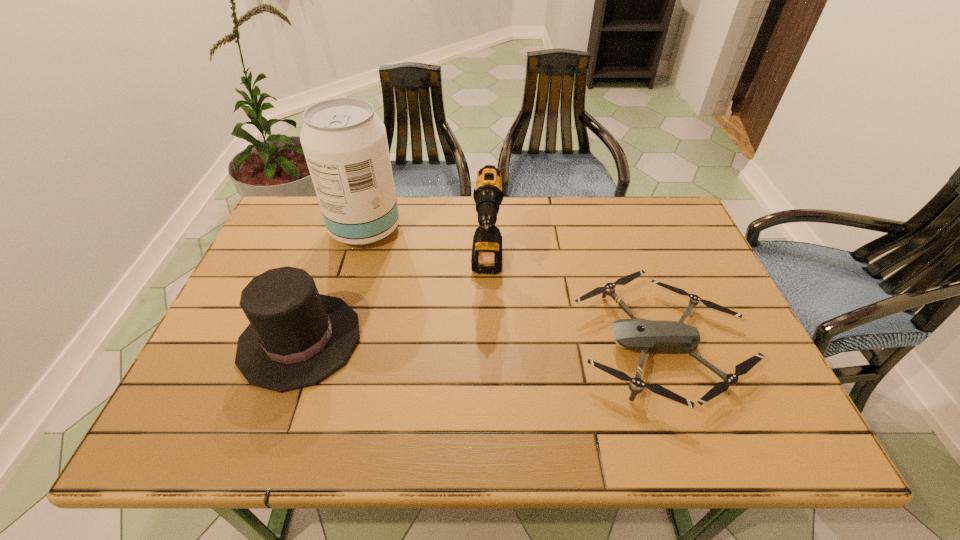
This screenshot has width=960, height=540. What are the coordinates of `alcohol` in the screenshot? It's located at (345, 144).

Where is `the third shortest object`? The width and height of the screenshot is (960, 540). the third shortest object is located at coordinates (486, 257).

The width and height of the screenshot is (960, 540). Identify the location of drill. (486, 257).

Where is `dress hat`? dress hat is located at coordinates (297, 337).

I want to click on the rightmost object, so click(653, 336).

Find the location of a particular element. The width and height of the screenshot is (960, 540). drone is located at coordinates (653, 336).

The height and width of the screenshot is (540, 960). Identify the location of free location located 0.120m on the front of the tallest object. (349, 282).

The width and height of the screenshot is (960, 540). I want to click on free space located 0.060m at the tip of the drill, so click(x=488, y=316).

This screenshot has width=960, height=540. In order to click on vacant space located on the front of the dress hat with the decoration in this screenshot , I will do `click(482, 340)`.

Locate an element on the screen. This screenshot has width=960, height=540. vacant region located with a camera mounted on the front of the shortest object is located at coordinates (509, 345).